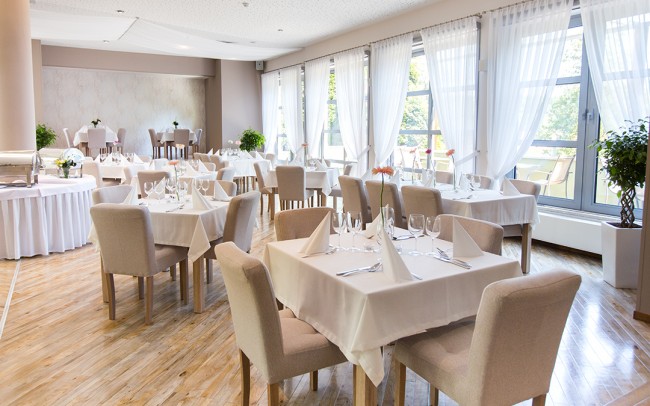
Find the location of a particular element. This screenshot has height=406, width=650. curtains is located at coordinates (270, 99), (292, 99), (316, 100), (348, 93), (385, 88), (454, 88), (517, 82), (624, 74).